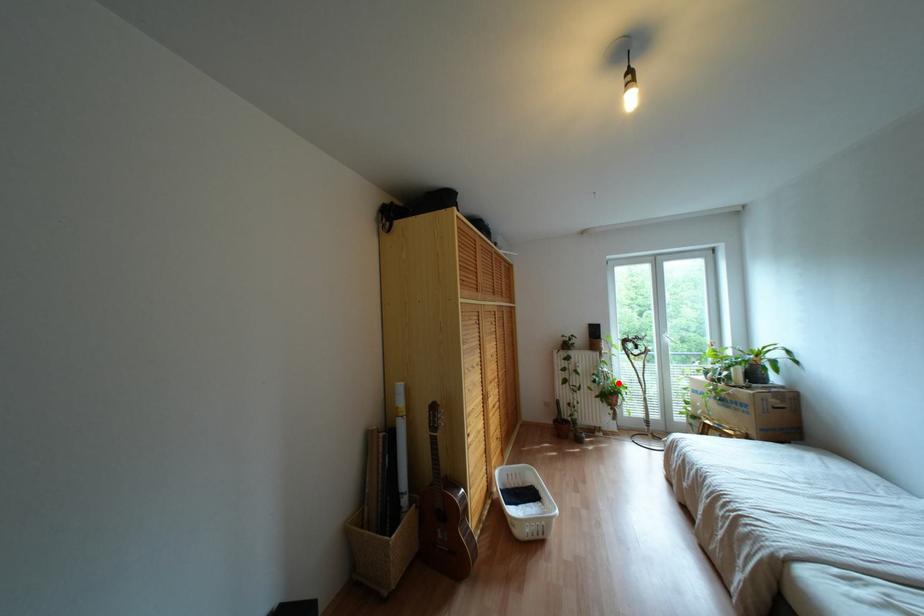
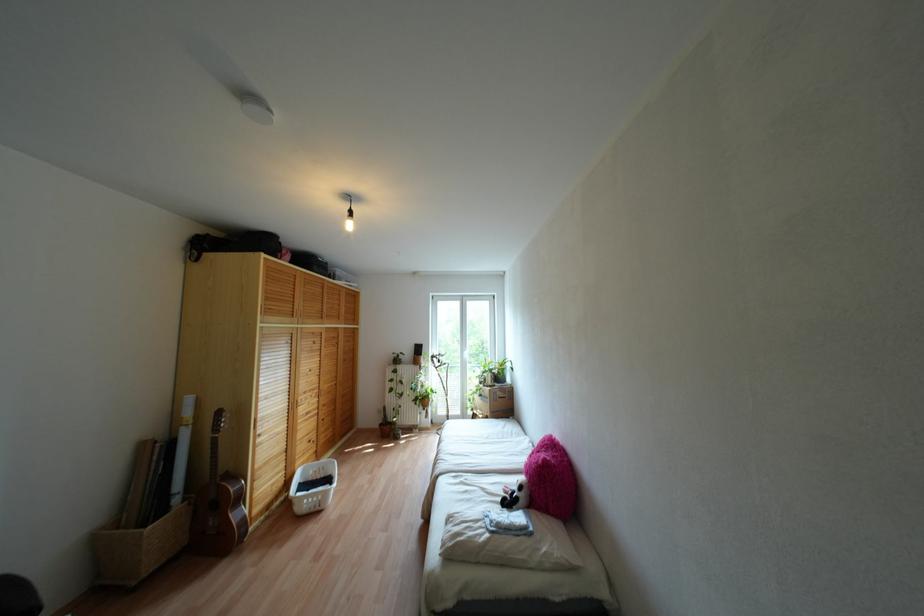
Question: I am providing you with two images of the same scene from different viewpoints. In image1, a red point is highlighted. Considering the same 3D point in image2, which of the following is correct?

Choices:
 (A) It is closer
 (B) It is farther

Answer: (B)